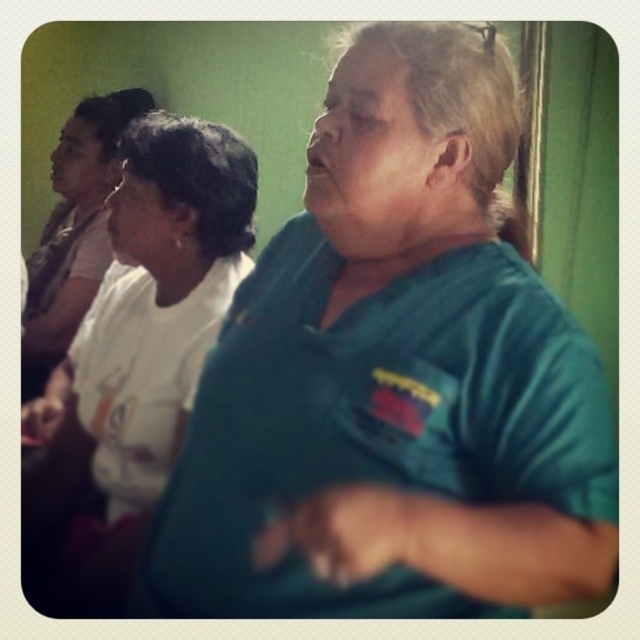
Question: Can you confirm if teal fabric shirt at center is positioned below white matte shirt at upper left?

Choices:
 (A) no
 (B) yes

Answer: (B)

Question: Does teal fabric shirt at center lie behind white matte shirt at upper left?

Choices:
 (A) no
 (B) yes

Answer: (A)

Question: Among these objects, which one is nearest to the camera?

Choices:
 (A) white matte shirt at upper left
 (B) teal fabric shirt at center

Answer: (B)

Question: Among these points, which one is nearest to the camera?

Choices:
 (A) (29, 472)
 (B) (365, 324)

Answer: (B)

Question: Considering the relative positions of teal fabric shirt at center and white matte shirt at upper left in the image provided, where is teal fabric shirt at center located with respect to white matte shirt at upper left?

Choices:
 (A) above
 (B) below

Answer: (B)